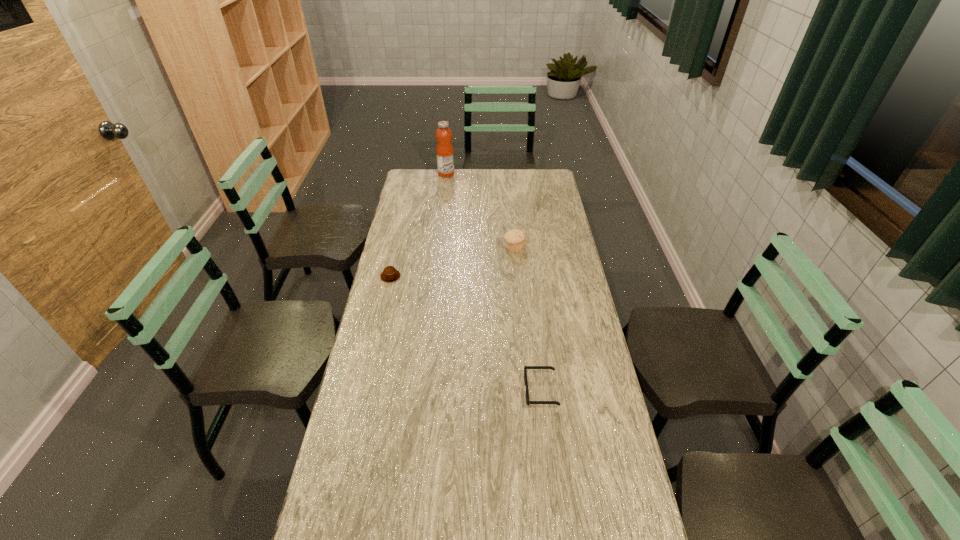
Where is `vacant space at the far left corner`? vacant space at the far left corner is located at coordinates (432, 173).

In the image, there is a desktop. Where is `vacant space at the far right corner`? This screenshot has width=960, height=540. vacant space at the far right corner is located at coordinates (554, 178).

Locate an element on the screen. Image resolution: width=960 pixels, height=540 pixels. free space between the second object from left to right and the sunglasses is located at coordinates (493, 282).

Locate an element on the screen. The width and height of the screenshot is (960, 540). free space between the second object from left to right and the nearest object is located at coordinates (493, 282).

This screenshot has height=540, width=960. In order to click on vacant space in between the fruit juice and the nearer muffin in this screenshot , I will do `click(419, 225)`.

This screenshot has width=960, height=540. Find the location of `free space between the left muffin and the taller muffin`. free space between the left muffin and the taller muffin is located at coordinates (452, 262).

Identify the location of vacant point located between the second farthest object and the farthest object. Image resolution: width=960 pixels, height=540 pixels. (480, 211).

The height and width of the screenshot is (540, 960). I want to click on vacant area that lies between the fruit juice and the farther muffin, so click(x=480, y=211).

Identify the location of vacant region between the third object from right to left and the third tallest object. (419, 225).

This screenshot has height=540, width=960. What are the coordinates of `free space between the farther muffin and the nearest object` in the screenshot? It's located at (527, 319).